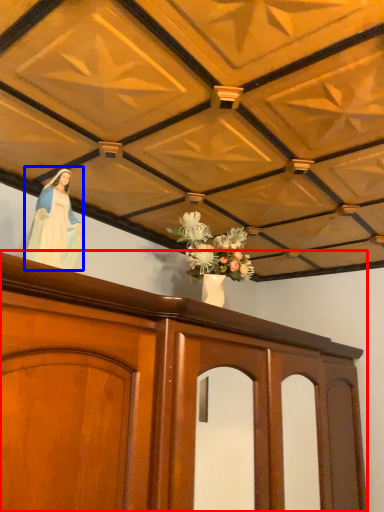
Question: Which of the following is the farthest to the observer, furniture (highlighted by a red box) or woman (highlighted by a blue box)?

Choices:
 (A) furniture
 (B) woman

Answer: (B)